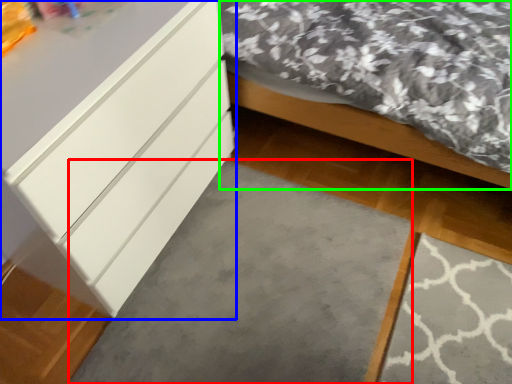
Question: Which is farther away from concrete (highlighted by a red box)? chest of drawers (highlighted by a blue box) or bed (highlighted by a green box)?

Choices:
 (A) chest of drawers
 (B) bed

Answer: (B)